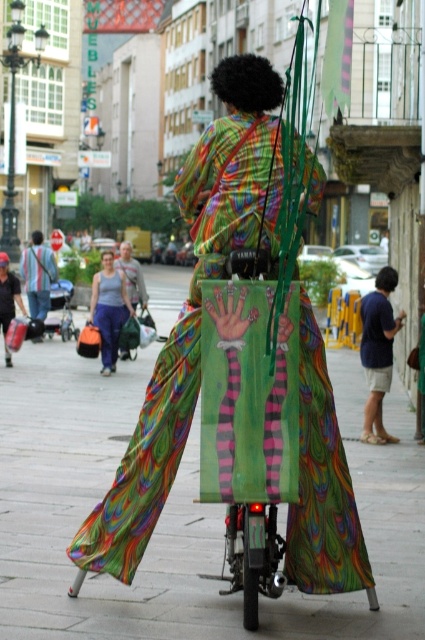
Between blue cotton shirt at lower right and matte black bag at left, which one appears on the right side from the viewer's perspective?

blue cotton shirt at lower right is more to the right.

Can you confirm if blue cotton shirt at lower right is shorter than matte black bag at left?

Yes.

Who is more distant from viewer, (373, 385) or (34, 308)?

The point (34, 308) is more distant.

You are a GUI agent. You are given a task and a screenshot of the screen. Output one action in this format:
    pyautogui.click(x=<x>, y=<y>)
    Task: Click on the blue cotton shirt at lower right
    The width and height of the screenshot is (425, 640).
    Given the screenshot: What is the action you would take?
    pyautogui.click(x=377, y=352)

Can you confirm if multicolored fabric street vendor at center is positioned above green fabric bag at center?

Actually, multicolored fabric street vendor at center is below green fabric bag at center.

Is multicolored fabric street vendor at center further to the viewer compared to green fabric bag at center?

No, it is not.

The image size is (425, 640). Describe the element at coordinates (187, 314) in the screenshot. I see `multicolored fabric street vendor at center` at that location.

The image size is (425, 640). Identify the location of multicolored fabric street vendor at center. (187, 314).

Can you confirm if matte gray tank top at center is positioned below matte black bag at left?

Indeed, matte gray tank top at center is positioned under matte black bag at left.

Describe the element at coordinates (108, 308) in the screenshot. I see `matte gray tank top at center` at that location.

Is point (107, 332) farther from camera compared to point (40, 314)?

No, (107, 332) is closer to viewer.

Locate an element on the screen. Image resolution: width=425 pixels, height=640 pixels. matte gray tank top at center is located at coordinates (108, 308).